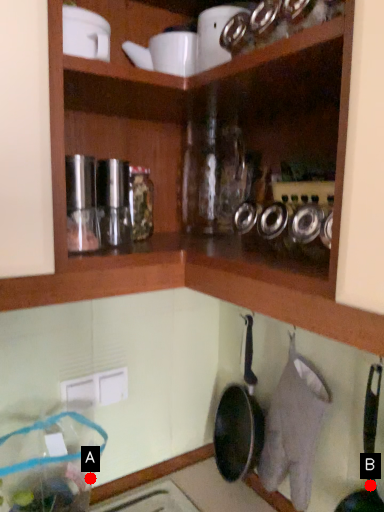
Question: Two points are circled on the image, labeled by A and B beside each circle. Which point is farther from the camera taking this photo?

Choices:
 (A) A is further
 (B) B is further

Answer: (A)